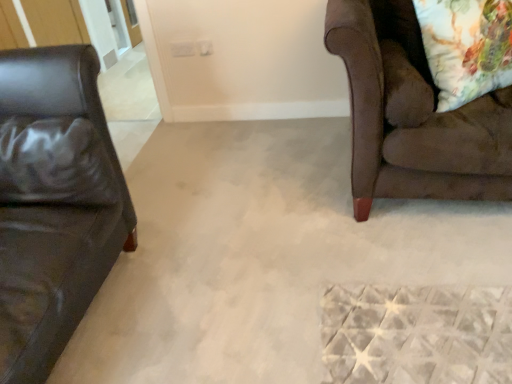
Question: From the image's perspective, does black leather pillow at left appear higher than brown suede couch at right?

Choices:
 (A) yes
 (B) no

Answer: (B)

Question: Is black leather pillow at left thinner than brown suede couch at right?

Choices:
 (A) no
 (B) yes

Answer: (B)

Question: Is black leather pillow at left looking in the opposite direction of brown suede couch at right?

Choices:
 (A) no
 (B) yes

Answer: (A)

Question: Can you confirm if black leather pillow at left is wider than brown suede couch at right?

Choices:
 (A) yes
 (B) no

Answer: (B)

Question: From a real-world perspective, is black leather pillow at left physically below brown suede couch at right?

Choices:
 (A) yes
 (B) no

Answer: (B)

Question: Is brown suede couch at right inside the boundaries of floral fabric pillow at upper right, or outside?

Choices:
 (A) outside
 (B) inside

Answer: (A)

Question: Considering the positions of brown suede couch at right and floral fabric pillow at upper right in the image, is brown suede couch at right wider or thinner than floral fabric pillow at upper right?

Choices:
 (A) thin
 (B) wide

Answer: (B)

Question: Is point (494, 162) positioned closer to the camera than point (464, 16)?

Choices:
 (A) farther
 (B) closer

Answer: (B)

Question: Relative to floral fabric pillow at upper right, is brown suede couch at right in front or behind?

Choices:
 (A) behind
 (B) front

Answer: (B)

Question: Does point (456, 79) appear closer or farther from the camera than point (87, 132)?

Choices:
 (A) closer
 (B) farther

Answer: (B)

Question: From a real-world perspective, relative to black leather pillow at left, is floral fabric pillow at upper right vertically above or below?

Choices:
 (A) below
 (B) above

Answer: (B)

Question: Choose the correct answer: Is floral fabric pillow at upper right inside black leather pillow at left or outside it?

Choices:
 (A) outside
 (B) inside

Answer: (A)

Question: In terms of size, does floral fabric pillow at upper right appear bigger or smaller than black leather pillow at left?

Choices:
 (A) big
 (B) small

Answer: (A)

Question: Is black leather pillow at left inside or outside of brown suede couch at right?

Choices:
 (A) outside
 (B) inside

Answer: (A)

Question: From the image's perspective, is black leather pillow at left located above or below brown suede couch at right?

Choices:
 (A) above
 (B) below

Answer: (B)